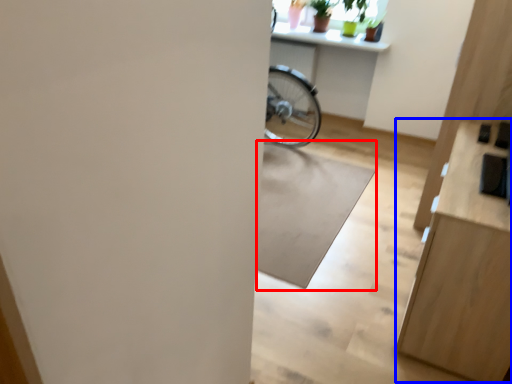
Question: Which point is further to the camera, mat (highlighted by a red box) or dresser (highlighted by a blue box)?

Choices:
 (A) mat
 (B) dresser

Answer: (A)